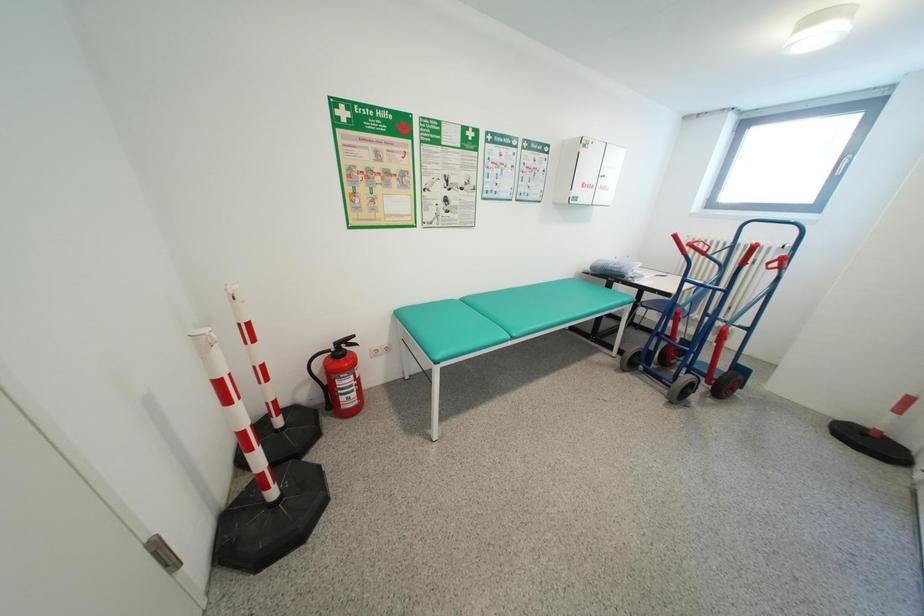
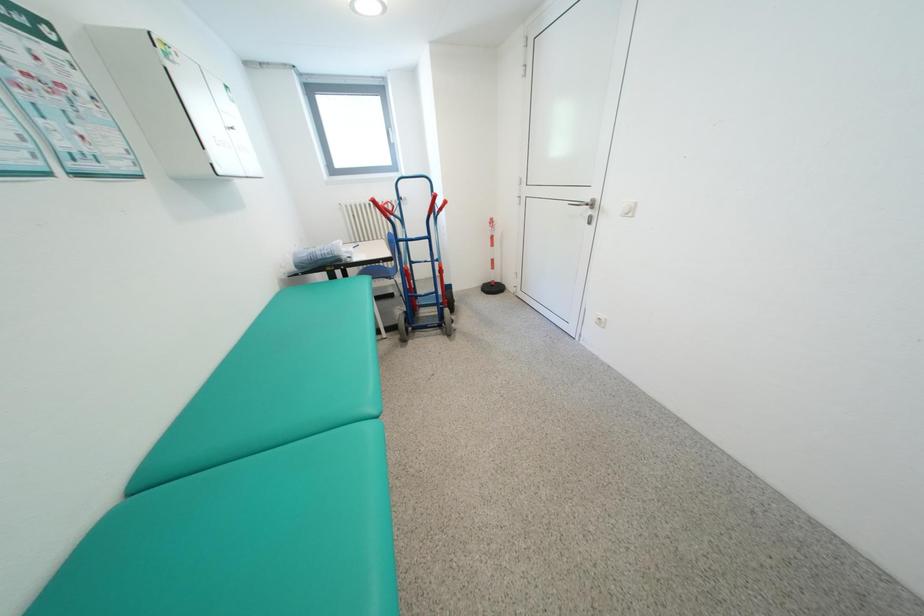
First-person continuous shooting, in which direction is the camera rotating?

The camera's rotation is toward right-down.